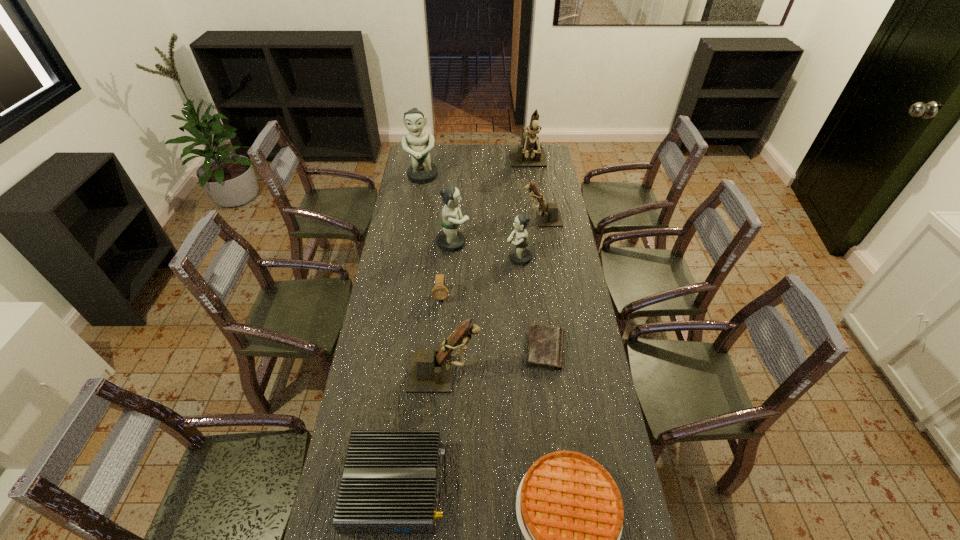
This screenshot has width=960, height=540. What are the coordinates of `watch` in the screenshot? It's located at (439, 292).

This screenshot has height=540, width=960. What are the coordinates of `the eighth tallest object` in the screenshot? It's located at (390, 480).

The height and width of the screenshot is (540, 960). I want to click on diary, so click(545, 344).

This screenshot has height=540, width=960. I want to click on vacant region located on the front-facing side of the biggest green figurine, so click(419, 202).

Where is `vacant space situated on the front-facing side of the farthest brown figurine`? This screenshot has height=540, width=960. vacant space situated on the front-facing side of the farthest brown figurine is located at coordinates (537, 216).

In order to click on vacant area located on the front-facing side of the second biggest green figurine in this screenshot , I will do `click(559, 243)`.

This screenshot has height=540, width=960. What are the coordinates of `free spot located 0.200m on the front-facing side of the nearest figurine` in the screenshot? It's located at click(x=539, y=373).

Identify the location of free space located 0.220m on the front-facing side of the smallest brown figurine. (476, 219).

The width and height of the screenshot is (960, 540). Identify the location of vacant area situated 0.210m on the front-facing side of the smallest brown figurine. (478, 219).

Identify the location of vacant space located on the front-facing side of the smallest brown figurine. The image size is (960, 540). (483, 219).